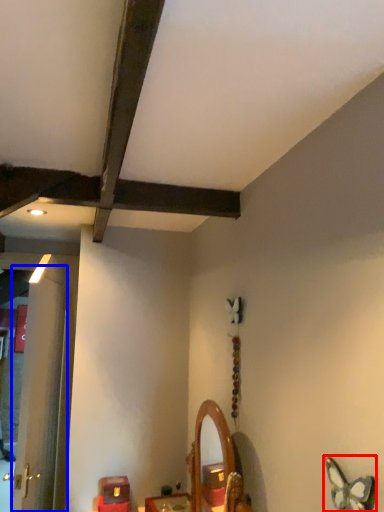
Question: Which object is closer to the camera taking this photo, butterfly (highlighted by a red box) or door (highlighted by a blue box)?

Choices:
 (A) butterfly
 (B) door

Answer: (A)